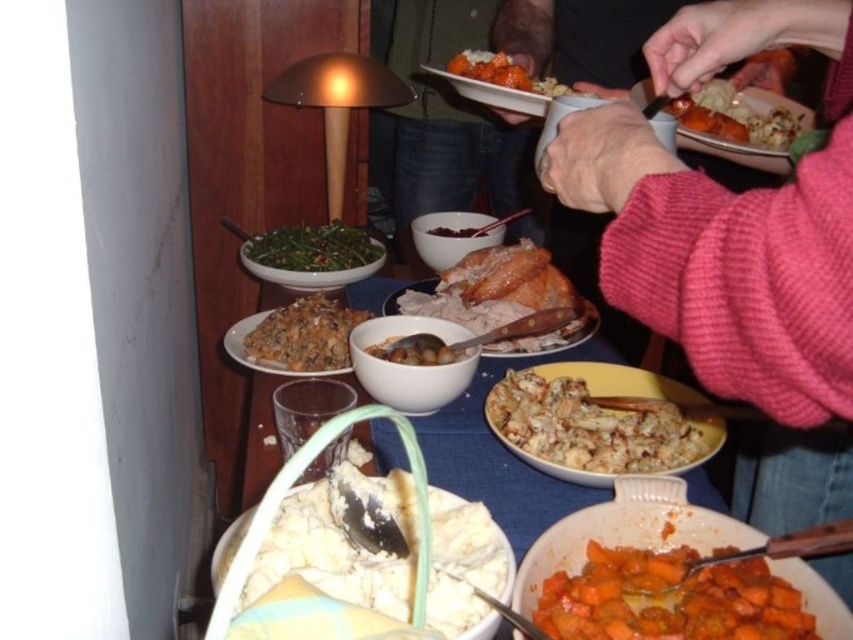
Does orange glazed sweet potato at lower right have a smaller size compared to matte white bowl at center?

Yes.

In the scene shown: Which is below, orange glazed sweet potato at lower right or matte white bowl at center?

Positioned lower is orange glazed sweet potato at lower right.

At what (x,y) coordinates should I click in order to perform the action: click on orange glazed sweet potato at lower right. Please return your answer as a coordinate pair (x, y). The width and height of the screenshot is (853, 640). Looking at the image, I should click on point(670,596).

Which of these two, golden brown roasted turkey at center or carrot glazed at upper center, stands shorter?

Standing shorter between the two is carrot glazed at upper center.

Does golden brown roasted turkey at center have a smaller size compared to carrot glazed at upper center?

Incorrect, golden brown roasted turkey at center is not smaller in size than carrot glazed at upper center.

Between point (485, 298) and point (479, 61), which one is positioned in front?

Point (479, 61) is more forward.

Where is `golden brown roasted turkey at center`? The width and height of the screenshot is (853, 640). golden brown roasted turkey at center is located at coordinates (497, 289).

Does golden brown roasted turkey at center lie behind golden brown roasted sweet potato at upper right?

Yes, golden brown roasted turkey at center is behind golden brown roasted sweet potato at upper right.

Which is above, golden brown roasted turkey at center or golden brown roasted sweet potato at upper right?

Positioned higher is golden brown roasted sweet potato at upper right.

Find the location of a particular element. This screenshot has width=853, height=640. golden brown roasted turkey at center is located at coordinates (497, 289).